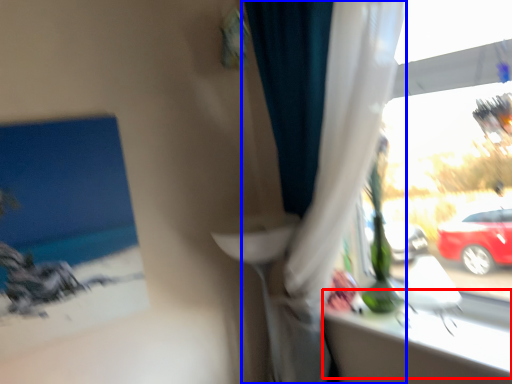
Question: Which point is further to the camera, window sill (highlighted by a red box) or curtain (highlighted by a blue box)?

Choices:
 (A) window sill
 (B) curtain

Answer: (A)